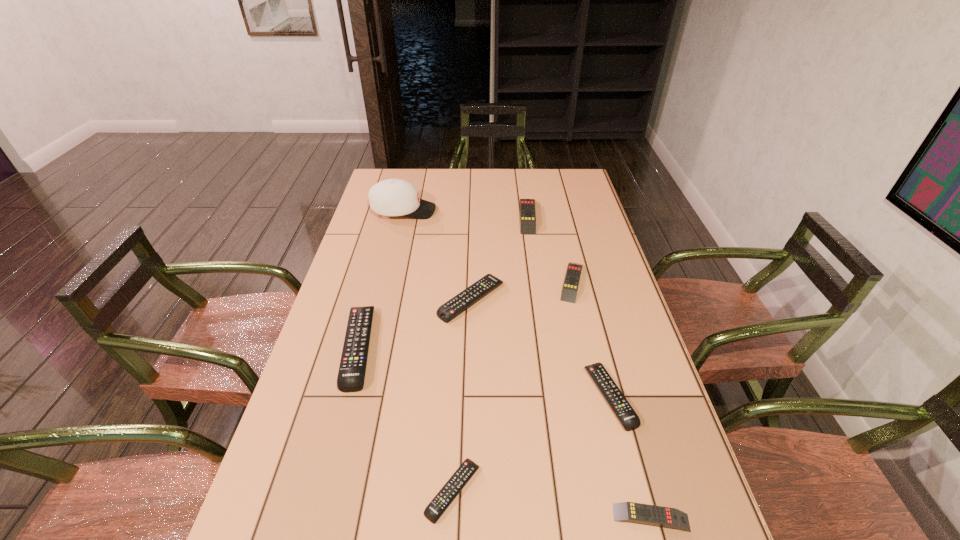
Image resolution: width=960 pixels, height=540 pixels. In order to click on free space between the second farthest yellow remote control and the farthest yellow remote control in this screenshot , I will do `click(550, 249)`.

The image size is (960, 540). Identify the location of empty space that is in between the leftmost remote control and the third biggest black remote control. (485, 372).

This screenshot has height=540, width=960. I want to click on free space between the leftmost black remote control and the second biggest black remote control, so (x=415, y=323).

At what (x,y) coordinates should I click in order to perform the action: click on free space between the white baseball cap and the third biggest black remote control. Please return your answer as a coordinate pair (x, y). The height and width of the screenshot is (540, 960). Looking at the image, I should click on (507, 303).

The height and width of the screenshot is (540, 960). What are the coordinates of `empty space between the third smallest black remote control and the tallest object` in the screenshot? It's located at (438, 255).

Identify which object is the sixth nearest to the nearest black remote control. Please provide its 2D coordinates. Your answer should be formatted as a tuple, i.e. [(x, y)], where the tuple contains the x and y coordinates of a point satisfying the conditions above.

[(527, 206)]

At what (x,y) coordinates should I click in order to perform the action: click on object that is the closest one to the second smallest black remote control. Please return your answer as a coordinate pair (x, y). This screenshot has height=540, width=960. Looking at the image, I should click on (661, 516).

You are a GUI agent. You are given a task and a screenshot of the screen. Output one action in this format:
    pyautogui.click(x=<x>, y=<y>)
    Task: Click on the remote control that stands as the second closest to the shortest object
    
    Given the screenshot: What is the action you would take?
    pyautogui.click(x=661, y=516)

The image size is (960, 540). Identify the location of remote control that stands as the second closest to the shortest remote control. (661, 516).

The image size is (960, 540). Find the location of `yellow remote control that stands as the second closest to the leftmost remote control`. yellow remote control that stands as the second closest to the leftmost remote control is located at coordinates (527, 206).